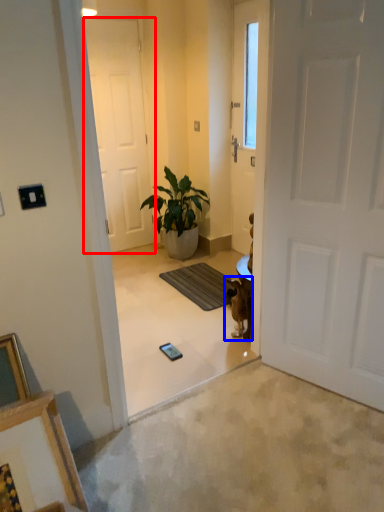
Question: Which of the following is the farthest to the observer, door (highlighted by a red box) or animal (highlighted by a blue box)?

Choices:
 (A) door
 (B) animal

Answer: (A)